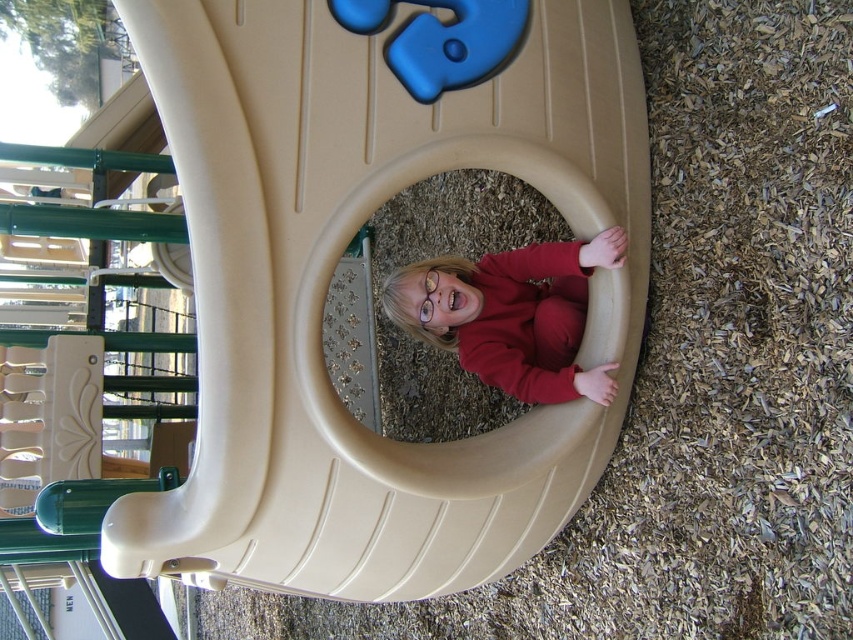
Does tan plastic slide at center appear on the right side of matte red sweater at center?

Incorrect, tan plastic slide at center is not on the right side of matte red sweater at center.

Between tan plastic slide at center and matte red sweater at center, which one has more height?

Standing taller between the two is tan plastic slide at center.

Which is in front, point (186, 36) or point (451, 326)?

Point (186, 36)

Find the location of a particular element. The image size is (853, 640). tan plastic slide at center is located at coordinates (331, 273).